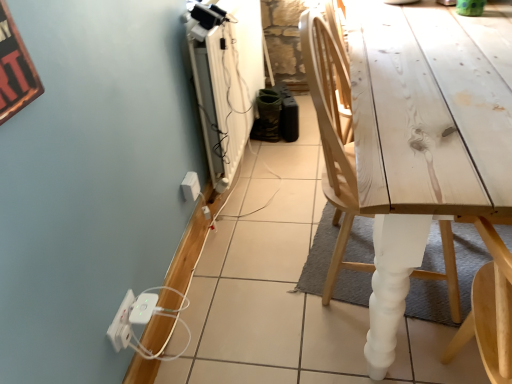
Question: Is white plastic power strip at lower left, which is counted as the 1th electric outlet, starting from the bottom, behind white plastic electric outlet at lower left, positioned as the first electric outlet in right-to-left order?

Choices:
 (A) no
 (B) yes

Answer: (A)

Question: Is white plastic power strip at lower left, which ranks as the 2th electric outlet in right-to-left order, in front of white plastic electric outlet at lower left, which is counted as the 1th electric outlet, starting from the back?

Choices:
 (A) yes
 (B) no

Answer: (A)

Question: Can we say white plastic power strip at lower left, which is counted as the 1th electric outlet, starting from the bottom, lies outside white plastic electric outlet at lower left, acting as the second electric outlet starting from the front?

Choices:
 (A) no
 (B) yes

Answer: (B)

Question: Does white plastic power strip at lower left, marked as the second electric outlet in a top-to-bottom arrangement, have a lesser width compared to white plastic electric outlet at lower left, the second electric outlet when ordered from bottom to top?

Choices:
 (A) yes
 (B) no

Answer: (A)

Question: Is white plastic power strip at lower left, which is counted as the 1th electric outlet, starting from the bottom, to the left of white plastic electric outlet at lower left, the second electric outlet when ordered from bottom to top, from the viewer's perspective?

Choices:
 (A) yes
 (B) no

Answer: (A)

Question: Is white plastic power strip at lower left, acting as the 1th electric outlet starting from the front, facing towards white plastic electric outlet at lower left, positioned as the first electric outlet in right-to-left order?

Choices:
 (A) no
 (B) yes

Answer: (A)

Question: From a real-world perspective, is white plastic electric outlet at lower left, which is the first electric outlet from top to bottom, physically below white plastic extension cord at lower left?

Choices:
 (A) no
 (B) yes

Answer: (A)

Question: Is white plastic electric outlet at lower left, which is counted as the 1th electric outlet, starting from the back, bigger than white plastic extension cord at lower left?

Choices:
 (A) no
 (B) yes

Answer: (B)

Question: Does white plastic electric outlet at lower left, the 2th electric outlet from the left, lie behind white plastic extension cord at lower left?

Choices:
 (A) yes
 (B) no

Answer: (A)

Question: Is white plastic electric outlet at lower left, the second electric outlet when ordered from bottom to top, taller than white plastic extension cord at lower left?

Choices:
 (A) yes
 (B) no

Answer: (A)

Question: Can you confirm if white plastic electric outlet at lower left, the 2th electric outlet from the left, is wider than white plastic extension cord at lower left?

Choices:
 (A) no
 (B) yes

Answer: (A)

Question: Is white plastic electric outlet at lower left, acting as the second electric outlet starting from the front, closer to camera compared to white plastic extension cord at lower left?

Choices:
 (A) no
 (B) yes

Answer: (A)

Question: Considering the relative sizes of white plastic extension cord at lower left and white plastic power strip at lower left, acting as the 1th electric outlet starting from the left, in the image provided, is white plastic extension cord at lower left shorter than white plastic power strip at lower left, acting as the 1th electric outlet starting from the left,?

Choices:
 (A) no
 (B) yes

Answer: (B)